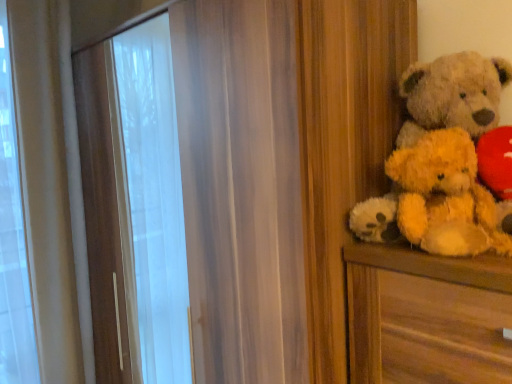
Question: Is yellow plush teddy bear at right wider or thinner than fuzzy beige teddy bear at right?

Choices:
 (A) thin
 (B) wide

Answer: (A)

Question: Is yellow plush teddy bear at right in front of or behind fuzzy beige teddy bear at right in the image?

Choices:
 (A) front
 (B) behind

Answer: (A)

Question: Is point (451, 150) closer or farther from the camera than point (450, 94)?

Choices:
 (A) farther
 (B) closer

Answer: (B)

Question: Relative to yellow plush teddy bear at right, is fuzzy beige teddy bear at right in front or behind?

Choices:
 (A) front
 (B) behind

Answer: (B)

Question: From the image's perspective, relative to yellow plush teddy bear at right, is fuzzy beige teddy bear at right above or below?

Choices:
 (A) above
 (B) below

Answer: (A)

Question: In terms of size, does fuzzy beige teddy bear at right appear bigger or smaller than yellow plush teddy bear at right?

Choices:
 (A) big
 (B) small

Answer: (A)

Question: Is point (367, 208) closer or farther from the camera than point (459, 158)?

Choices:
 (A) closer
 (B) farther

Answer: (B)